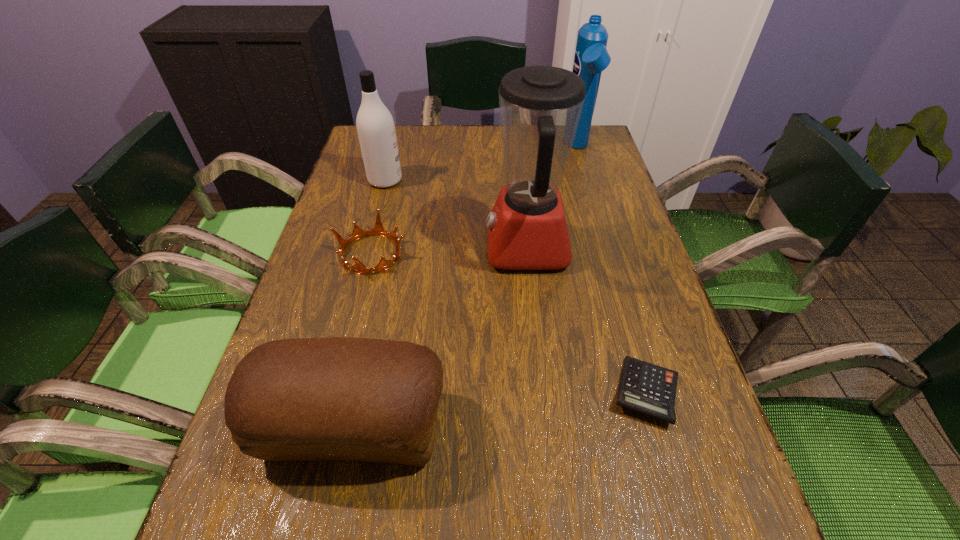
I want to click on shampoo situated at the right edge, so click(591, 57).

Find the location of a particular element. This screenshot has height=540, width=960. calculator that is at the right edge is located at coordinates (646, 388).

Identify the location of object that is at the far right corner. Image resolution: width=960 pixels, height=540 pixels. (591, 57).

Where is `free location at the far edge`? This screenshot has height=540, width=960. free location at the far edge is located at coordinates (434, 162).

The height and width of the screenshot is (540, 960). What are the coordinates of `vacant space at the left edge of the desktop` in the screenshot? It's located at (361, 184).

In the image, there is a desktop. Find the location of `vacant space at the right edge`. vacant space at the right edge is located at coordinates (572, 165).

In order to click on free spot at the far right corner of the desktop in this screenshot , I will do `click(604, 146)`.

Where is `free space between the farther shampoo and the shortest object`? This screenshot has height=540, width=960. free space between the farther shampoo and the shortest object is located at coordinates (612, 270).

Identify the location of free space between the fourth object from left to right and the third shortest object. (441, 338).

This screenshot has width=960, height=540. Find the location of `vacant space that's between the fourth tallest object and the blender`. vacant space that's between the fourth tallest object and the blender is located at coordinates 441,338.